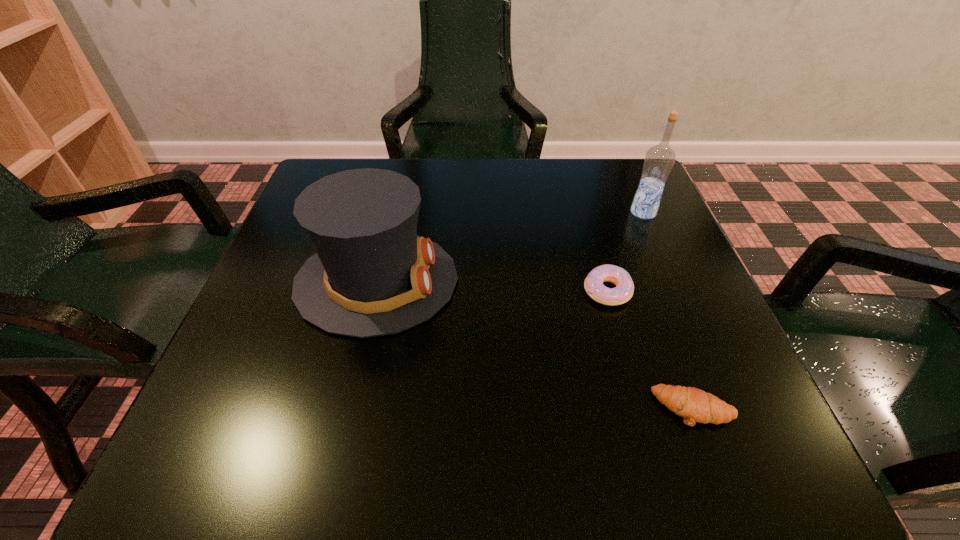
The image size is (960, 540). Identify the location of free space at the right edge. (625, 261).

Find the location of a particular element. The height and width of the screenshot is (540, 960). vacant space at the far left corner of the desktop is located at coordinates (340, 169).

In the image, there is a desktop. Identify the location of vacant space at the far right corner. (595, 191).

Find the location of `vacant area that lies between the doughnut and the tallest object`. vacant area that lies between the doughnut and the tallest object is located at coordinates (625, 252).

Identify the location of vacant region between the nearest object and the third shortest object. This screenshot has width=960, height=540. (535, 345).

Locate an element on the screen. vacant space that's between the tallest object and the leftmost object is located at coordinates (510, 247).

What are the coordinates of `free space between the leftmost object and the crescent roll` in the screenshot? It's located at (535, 345).

Locate an element on the screen. free space between the vodka and the doughnut is located at coordinates (625, 252).

I want to click on vacant space that is in between the vodka and the doughnut, so click(x=625, y=252).

The width and height of the screenshot is (960, 540). Find the location of `vacant area between the nearest object and the leftmost object`. vacant area between the nearest object and the leftmost object is located at coordinates (535, 345).